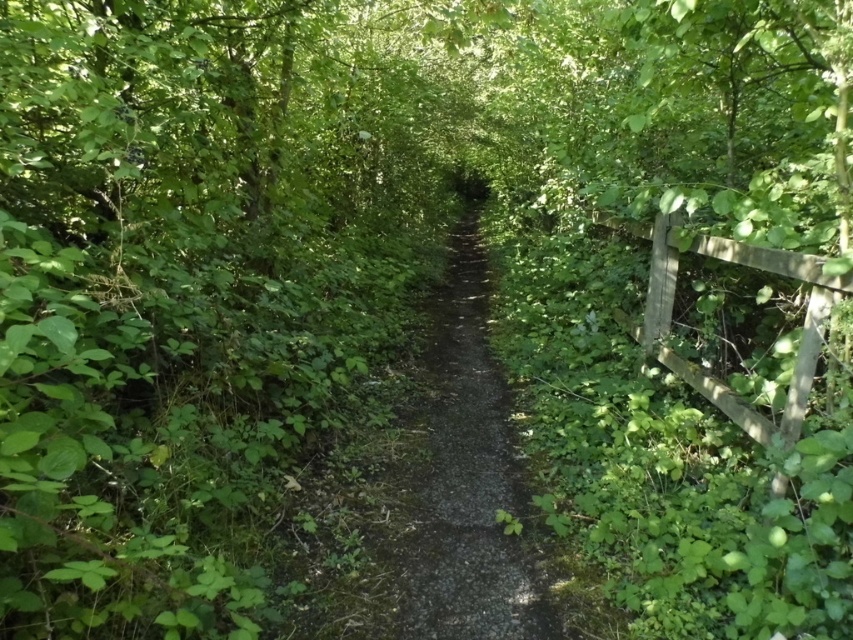
You are standing on the narrow path through the greenery and want to reach a specific point marked at coordinates (461, 544). If your height is 1.7 meters, can you comfortably walk to that point without bending down?

The distance between you and the point is 1.79 meters. Since the path is narrow and flanked by dense vegetation, you may need to bend slightly due to the overgrown plants on both sides, but the distance itself is manageable.

You are standing at the start of the path and want to walk towards the wooden fence on the right. There are two points marked on the path at coordinates point (519, 545) and point (666, 360). Which point should you step on first to reach the fence?

You should step on point (519, 545) first because it is closer to the camera, meaning it is nearer to your starting position and thus the first point you would encounter as you walk toward the fence.